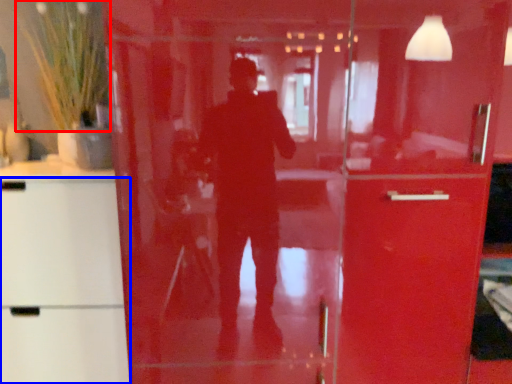
Question: Among these objects, which one is nearest to the camera, plant (highlighted by a red box) or cabinetry (highlighted by a blue box)?

Choices:
 (A) plant
 (B) cabinetry

Answer: (B)